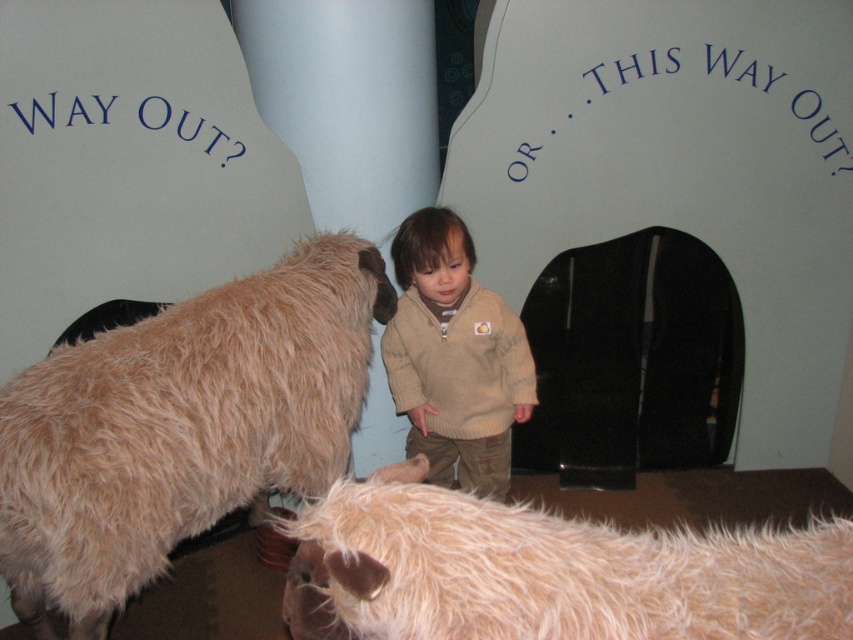
Question: Does fuzzy woolen sheep at lower left appear under fluffy beige goat at lower center?

Choices:
 (A) no
 (B) yes

Answer: (A)

Question: Which object is the closest to the fluffy beige goat at lower center?

Choices:
 (A) fuzzy woolen sheep at lower left
 (B) beige knitted sweater at center

Answer: (A)

Question: Estimate the real-world distances between objects in this image. Which object is closer to the fuzzy woolen sheep at lower left?

Choices:
 (A) fluffy beige goat at lower center
 (B) beige knitted sweater at center

Answer: (B)

Question: Which of the following is the closest to the observer?

Choices:
 (A) fluffy beige goat at lower center
 (B) fuzzy woolen sheep at lower left
 (C) beige knitted sweater at center

Answer: (A)

Question: Can you confirm if fuzzy woolen sheep at lower left is wider than beige knitted sweater at center?

Choices:
 (A) no
 (B) yes

Answer: (B)

Question: Is fuzzy woolen sheep at lower left thinner than fluffy beige goat at lower center?

Choices:
 (A) no
 (B) yes

Answer: (A)